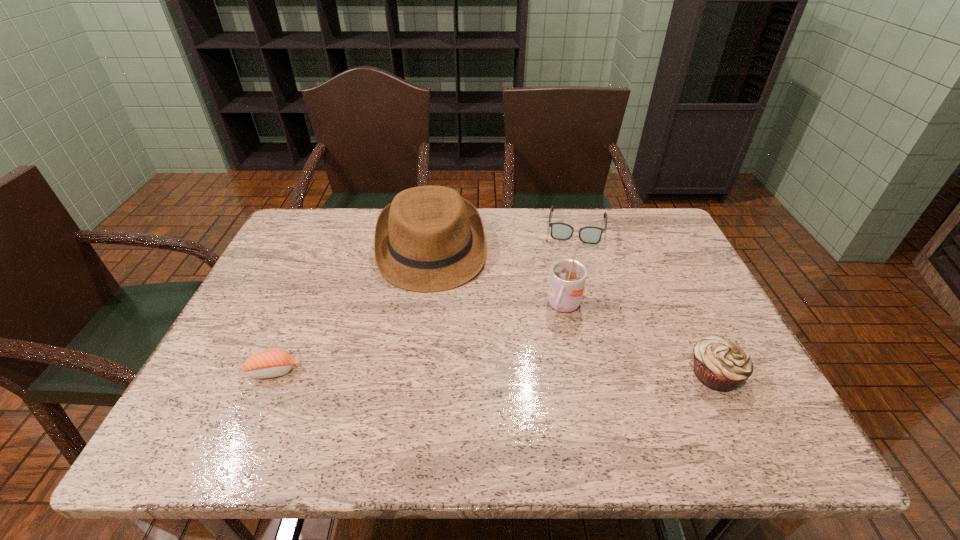
I want to click on sushi, so click(271, 363).

This screenshot has height=540, width=960. In order to click on the third tallest object in this screenshot , I will do `click(720, 363)`.

I want to click on the rightmost object, so click(720, 363).

This screenshot has width=960, height=540. In order to click on spectacles in this screenshot , I will do `click(560, 231)`.

Identify the location of cup. This screenshot has height=540, width=960. (567, 279).

The image size is (960, 540). In order to click on fedora in this screenshot , I will do `click(429, 239)`.

At what (x,y) coordinates should I click in order to perform the action: click on vacant area located on the back of the sushi. Please return your answer as a coordinate pair (x, y). The width and height of the screenshot is (960, 540). Looking at the image, I should click on (289, 338).

What are the coordinates of `vacant region located on the left of the muffin` in the screenshot? It's located at (660, 374).

The image size is (960, 540). In order to click on free space located on the face of the spectacles in this screenshot , I will do (x=568, y=294).

Where is `vacant space located on the face of the spectacles`? This screenshot has height=540, width=960. vacant space located on the face of the spectacles is located at coordinates (565, 309).